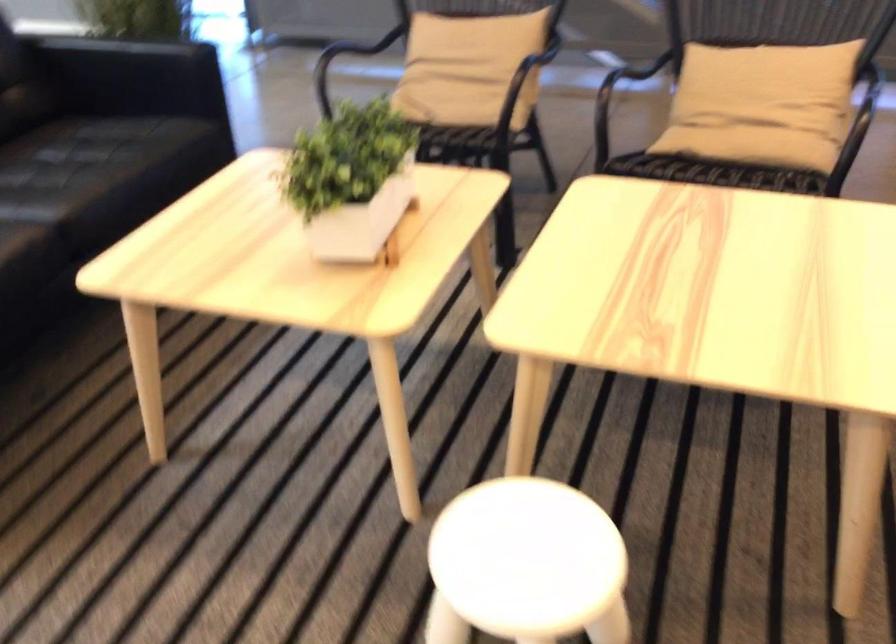
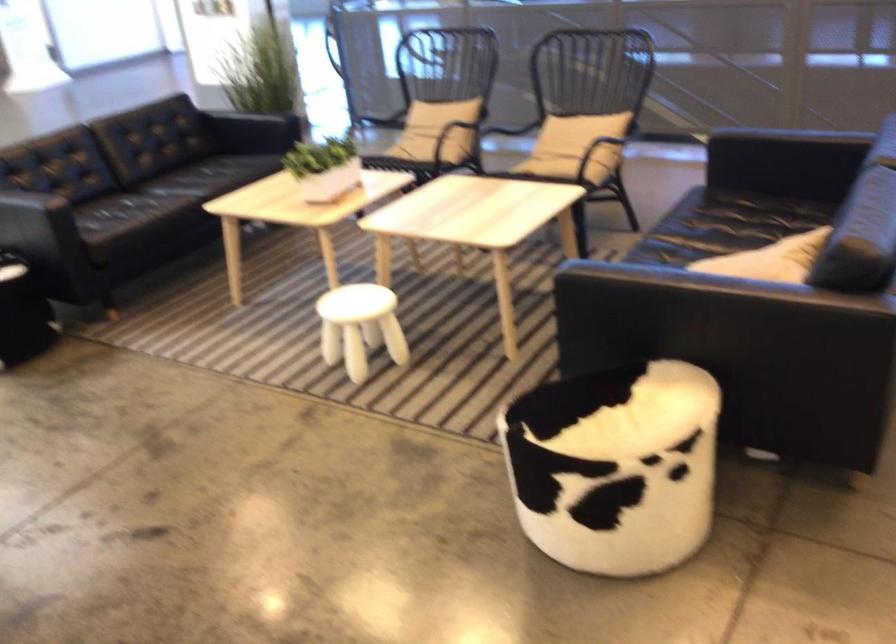
The point at (376, 187) is marked in the first image. Where is the corresponding point in the second image?

(323, 167)